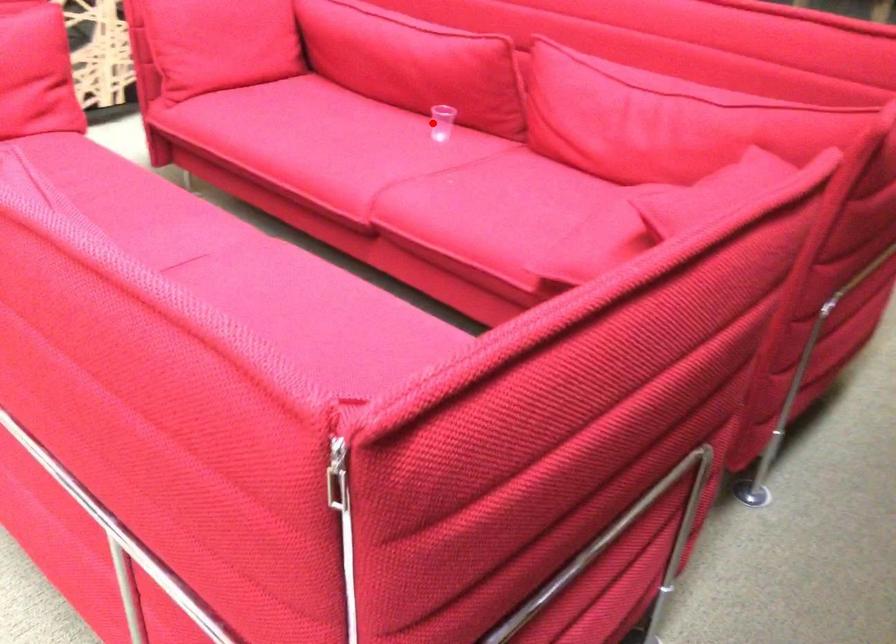
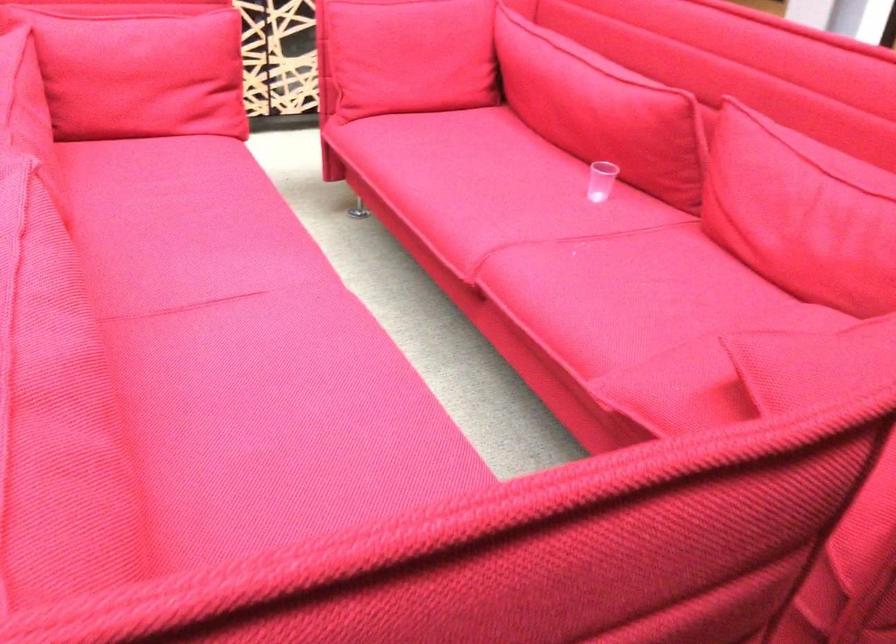
Question: I am providing you with two images of the same scene from different viewpoints. A red point is shown in image1. For the corresponding object point in image2, is it positioned nearer or farther from the camera?

Choices:
 (A) Nearer
 (B) Farther

Answer: (A)